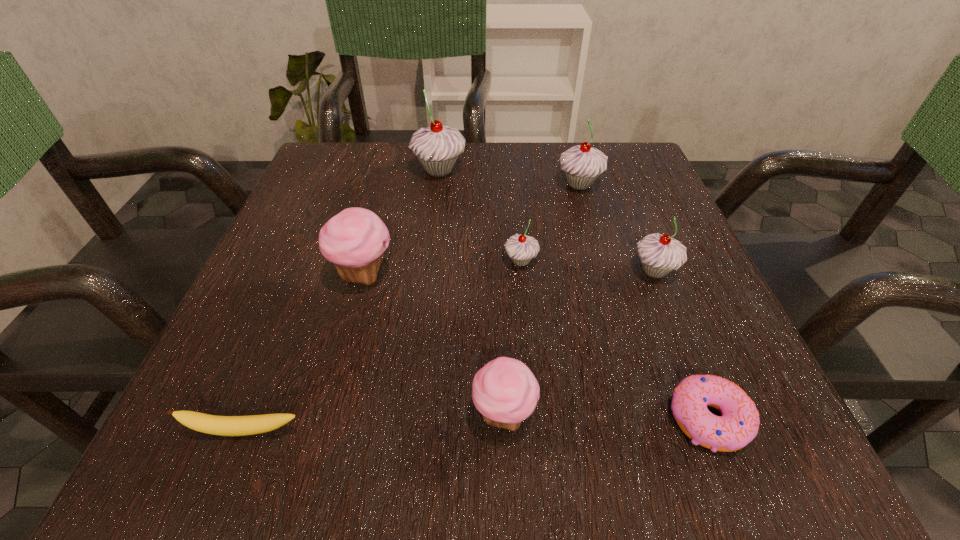
Locate an element on the screen. The height and width of the screenshot is (540, 960). the leftmost gray cupcake is located at coordinates (437, 147).

This screenshot has width=960, height=540. What are the coordinates of `the biggest gray cupcake` in the screenshot? It's located at (437, 147).

Locate an element on the screen. the second tallest object is located at coordinates (581, 164).

Image resolution: width=960 pixels, height=540 pixels. I want to click on the second tallest cupcake, so click(x=581, y=164).

Where is `the bigger pink cupcake`? This screenshot has height=540, width=960. the bigger pink cupcake is located at coordinates point(355,239).

Identify the location of the farther pink cupcake. This screenshot has height=540, width=960. (355, 239).

Locate an element on the screen. Image resolution: width=960 pixels, height=540 pixels. the rightmost gray cupcake is located at coordinates (659, 254).

The width and height of the screenshot is (960, 540). In order to click on the rightmost cupcake in this screenshot , I will do `click(659, 254)`.

Locate an element on the screen. Image resolution: width=960 pixels, height=540 pixels. the second gray cupcake from left to right is located at coordinates (521, 249).

Where is `the smaller pink cupcake`? the smaller pink cupcake is located at coordinates (505, 391).